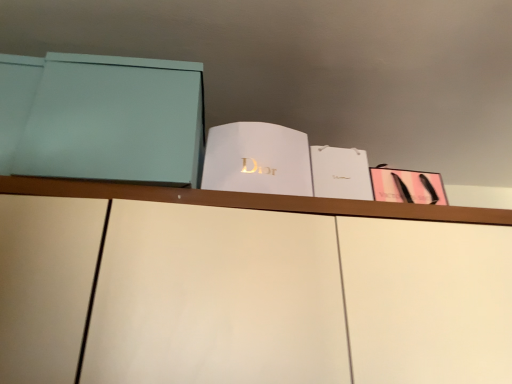
Question: Is matte teal box at left, marked as the first paperback book in a left-to-right arrangement, at the left side of pink matte paper at upper right, which is counted as the fourth paperback book, starting from the left?

Choices:
 (A) yes
 (B) no

Answer: (A)

Question: Is matte teal box at left, marked as the first paperback book in a left-to-right arrangement, facing away from pink matte paper at upper right, which is counted as the fourth paperback book, starting from the left?

Choices:
 (A) yes
 (B) no

Answer: (B)

Question: Is matte teal box at left, marked as the first paperback book in a left-to-right arrangement, far away from pink matte paper at upper right, which is counted as the fourth paperback book, starting from the left?

Choices:
 (A) yes
 (B) no

Answer: (B)

Question: From a real-world perspective, is matte teal box at left, which is the 4th paperback book in right-to-left order, beneath pink matte paper at upper right, which is counted as the fourth paperback book, starting from the left?

Choices:
 (A) no
 (B) yes

Answer: (A)

Question: Is matte teal box at left, marked as the first paperback book in a left-to-right arrangement, completely or partially outside of pink matte paper at upper right, which is counted as the fourth paperback book, starting from the left?

Choices:
 (A) yes
 (B) no

Answer: (A)

Question: Is matte teal box at left, which is the 4th paperback book in right-to-left order, touching pink matte paper at upper right, positioned as the 1th paperback book in right-to-left order?

Choices:
 (A) yes
 (B) no

Answer: (B)

Question: Is matte teal box at left, marked as the first paperback book in a left-to-right arrangement, at the left side of white paper at center, which appears as the second paperback book when viewed from the right?

Choices:
 (A) yes
 (B) no

Answer: (A)

Question: Is matte teal box at left, marked as the first paperback book in a left-to-right arrangement, oriented away from white paper at center, which appears as the second paperback book when viewed from the right?

Choices:
 (A) yes
 (B) no

Answer: (B)

Question: Is matte teal box at left, which is the 4th paperback book in right-to-left order, positioned in front of white paper at center, which appears as the second paperback book when viewed from the right?

Choices:
 (A) no
 (B) yes

Answer: (B)

Question: Is matte teal box at left, marked as the first paperback book in a left-to-right arrangement, oriented towards white paper at center, arranged as the 3th paperback book when viewed from the left?

Choices:
 (A) no
 (B) yes

Answer: (A)

Question: Can you confirm if matte teal box at left, which is the 4th paperback book in right-to-left order, is taller than white paper at center, arranged as the 3th paperback book when viewed from the left?

Choices:
 (A) no
 (B) yes

Answer: (B)

Question: Is matte teal box at left, which is the 4th paperback book in right-to-left order, wider than white paper at center, which appears as the second paperback book when viewed from the right?

Choices:
 (A) yes
 (B) no

Answer: (A)

Question: Considering the relative sizes of white paper at center, which appears as the second paperback book when viewed from the right, and white paper at center, acting as the second paperback book starting from the left, in the image provided, is white paper at center, which appears as the second paperback book when viewed from the right, taller than white paper at center, acting as the second paperback book starting from the left,?

Choices:
 (A) yes
 (B) no

Answer: (B)